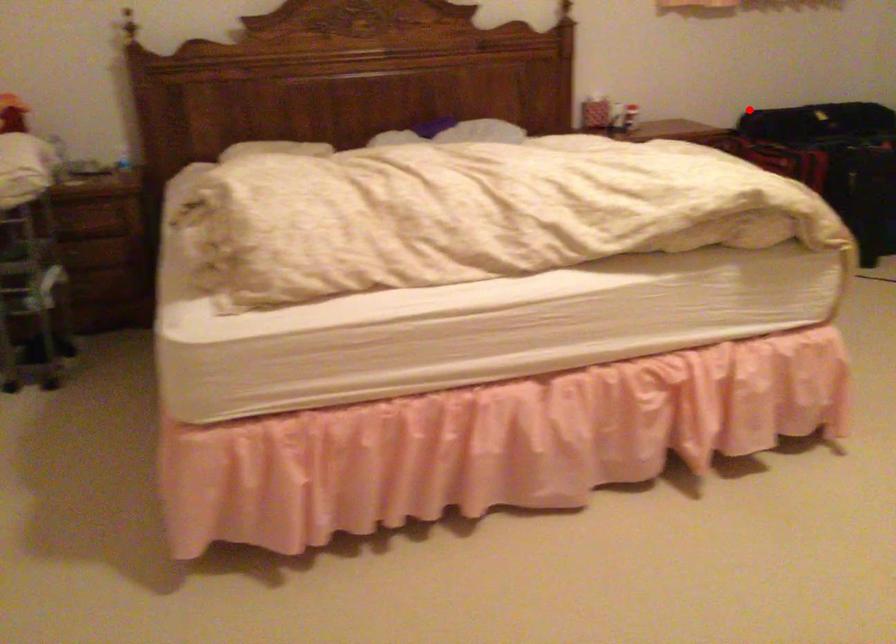
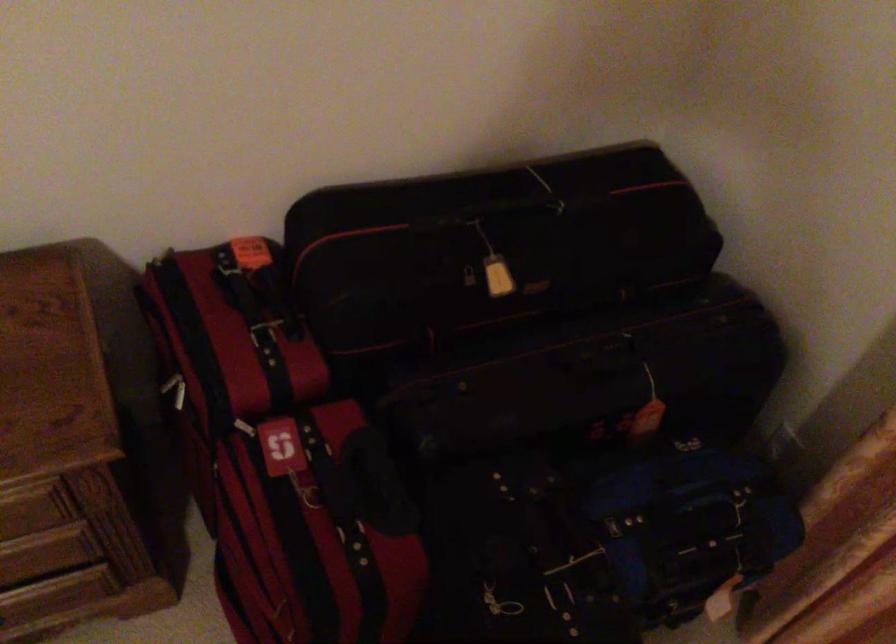
The point at the highlighted location is marked in the first image. Where is the corresponding point in the second image?

(264, 334)